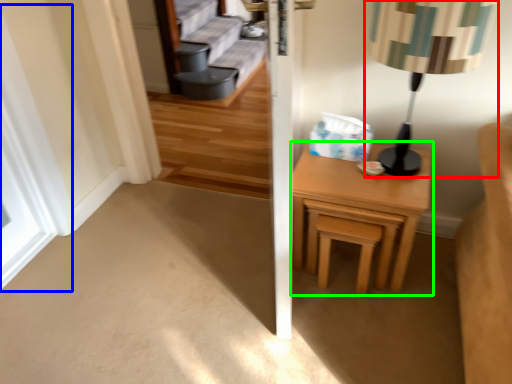
Question: Which object is the farthest from table lamp (highlighted by a red box)? Choose among these: window (highlighted by a blue box) or nightstand (highlighted by a green box).

Choices:
 (A) window
 (B) nightstand

Answer: (A)